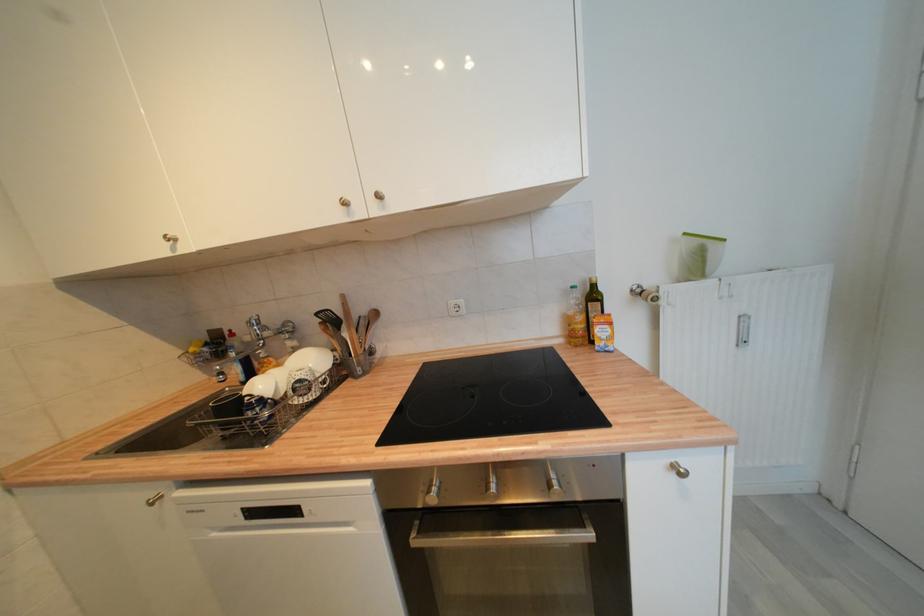
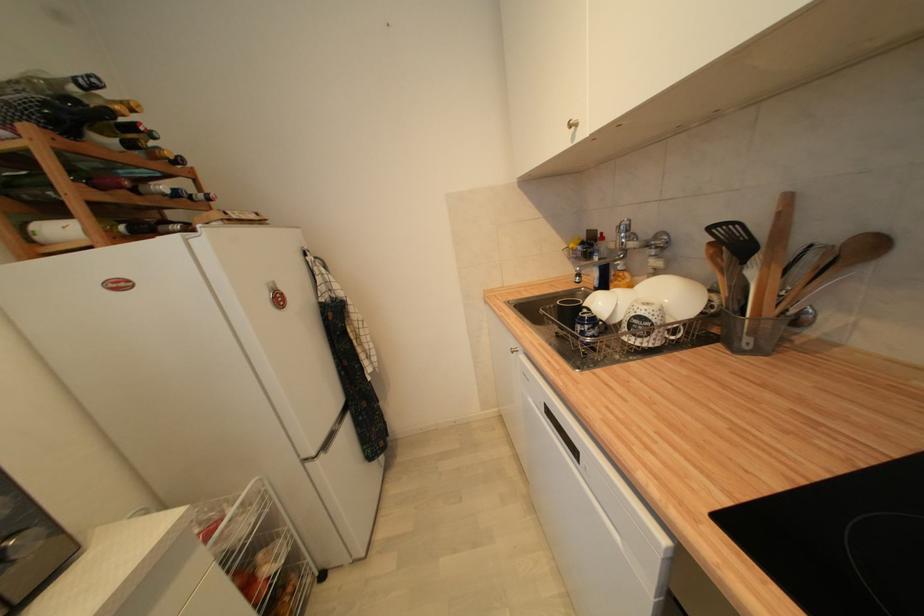
How did the camera likely rotate?

The camera's rotation is toward left-down.